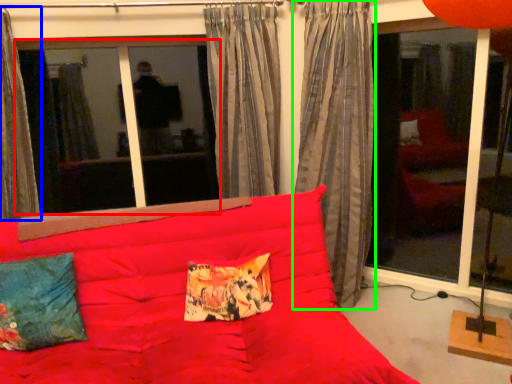
Question: Which object is positioned closest to window screen (highlighted by a red box)? Select from curtain (highlighted by a blue box) and curtain (highlighted by a green box).

Choices:
 (A) curtain
 (B) curtain

Answer: (A)